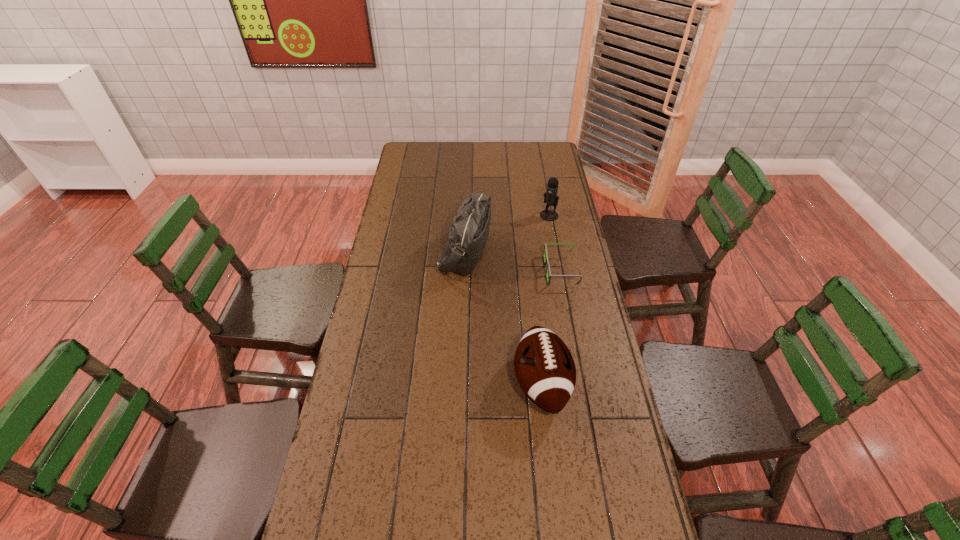
Find the location of a particular element. The width and height of the screenshot is (960, 540). shoulder bag is located at coordinates (468, 233).

Where is `the leftmost object`? This screenshot has height=540, width=960. the leftmost object is located at coordinates (468, 233).

Locate an element on the screen. This screenshot has height=540, width=960. microphone is located at coordinates (550, 197).

Where is `football (American)`? This screenshot has height=540, width=960. football (American) is located at coordinates (544, 367).

Find the location of a particular element. The image size is (960, 540). spectacles is located at coordinates pos(546,261).

You are a GUI agent. You are given a task and a screenshot of the screen. Output one action in this format:
    pyautogui.click(x=<x>, y=<y>)
    Task: Click on the vacant area located at the front padded panel of the tallest object
    The height and width of the screenshot is (540, 960).
    Given the screenshot: What is the action you would take?
    pyautogui.click(x=542, y=252)

At what (x,y) coordinates should I click in order to perform the action: click on vacant space located on the front of the farthest object. Please return your answer as a coordinate pair (x, y). The image size is (960, 540). Looking at the image, I should click on (556, 253).

Where is `blank area located 0.050m on the back of the nearest object`? This screenshot has height=540, width=960. blank area located 0.050m on the back of the nearest object is located at coordinates (536, 332).

Locate an element on the screen. The width and height of the screenshot is (960, 540). vacant space positioned on the lens of the spectacles is located at coordinates (513, 271).

Where is `vacant space situated 0.080m on the lens of the spectacles`? The width and height of the screenshot is (960, 540). vacant space situated 0.080m on the lens of the spectacles is located at coordinates (523, 271).